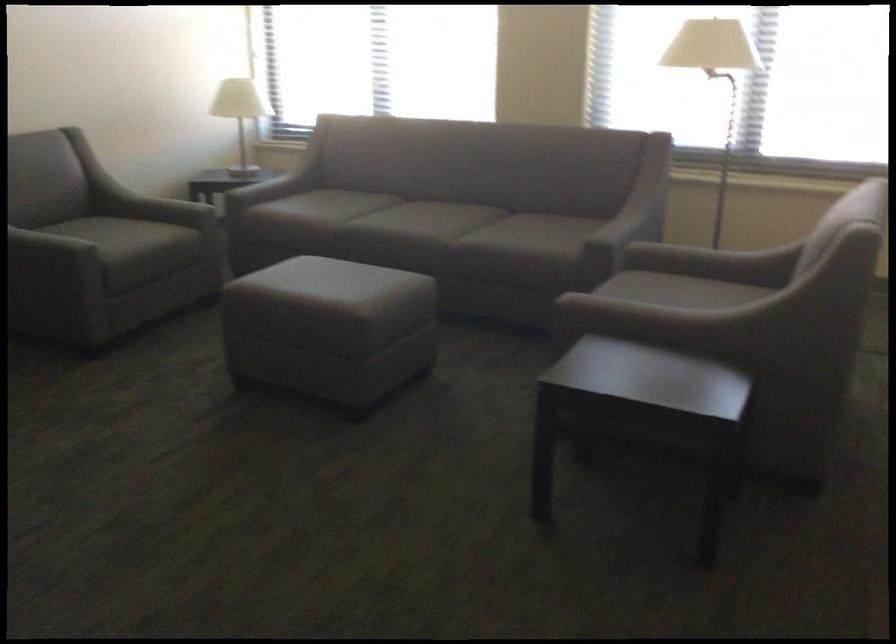
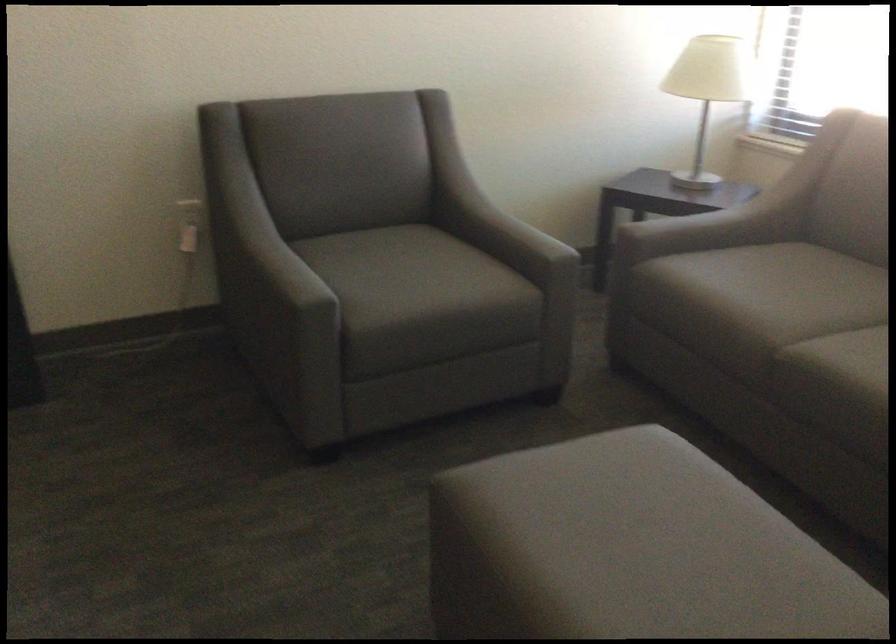
The point at (219,198) is marked in the first image. Where is the corresponding point in the second image?

(643, 214)